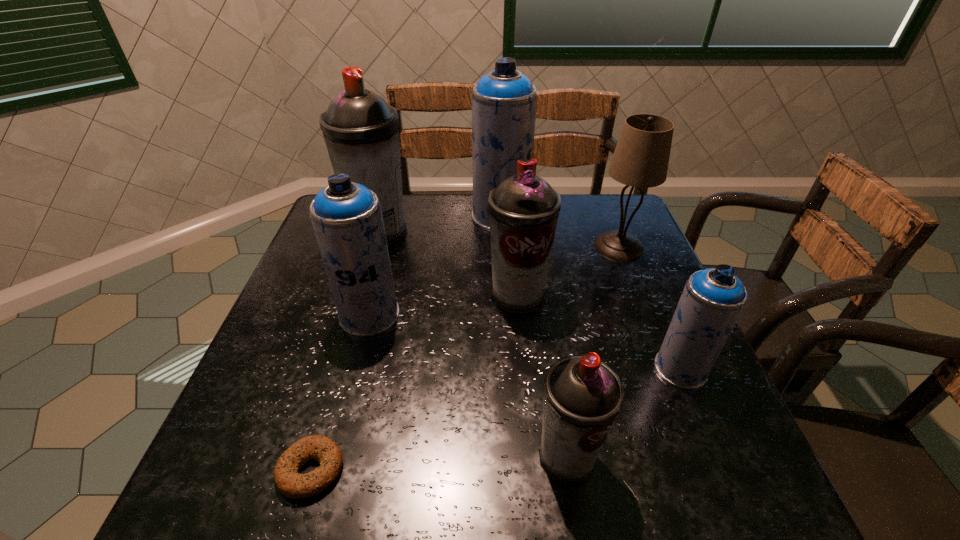
Image resolution: width=960 pixels, height=540 pixels. I want to click on the farthest gray aerosol can, so click(361, 131).

The width and height of the screenshot is (960, 540). Identify the location of the biggest gray aerosol can. (361, 131).

Locate an element on the screen. The height and width of the screenshot is (540, 960). the biggest blue aerosol can is located at coordinates (504, 101).

The width and height of the screenshot is (960, 540). What are the coordinates of `the farthest blue aerosol can` in the screenshot? It's located at (504, 101).

You are a GUI agent. You are given a task and a screenshot of the screen. Output one action in this format:
    pyautogui.click(x=<x>, y=<y>)
    Task: Click on the lampshade
    The image size is (960, 540).
    Given the screenshot: What is the action you would take?
    pyautogui.click(x=641, y=157)

The image size is (960, 540). Identify the location of the second nearest blue aerosol can. (347, 219).

The height and width of the screenshot is (540, 960). What are the coordinates of `the leftmost blue aerosol can` in the screenshot? It's located at (347, 219).

The width and height of the screenshot is (960, 540). I want to click on the second nearest gray aerosol can, so (523, 210).

Where is `the second nearest aerosol can`? the second nearest aerosol can is located at coordinates (713, 299).

You are a GUI agent. You are given a task and a screenshot of the screen. Output one action in this format:
    pyautogui.click(x=<x>, y=<y>)
    Task: Click on the third nearest object
    The width and height of the screenshot is (960, 540).
    Given the screenshot: What is the action you would take?
    pyautogui.click(x=713, y=299)